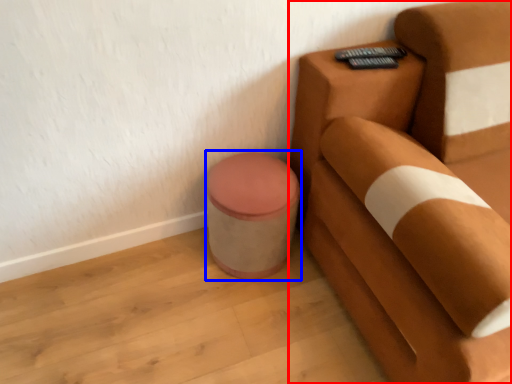
Question: Which object is further to the camera taking this photo, furniture (highlighted by a red box) or potty (highlighted by a blue box)?

Choices:
 (A) furniture
 (B) potty

Answer: (B)